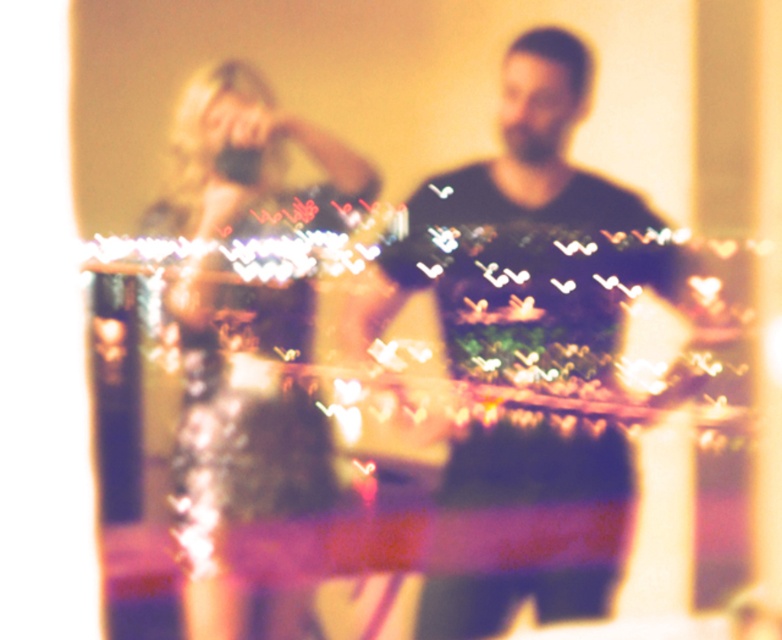
Between dark green sweater at center and shiny silver dress at center, which one has more height?

With more height is dark green sweater at center.

Is point (522, 492) closer to camera compared to point (357, 196)?

Yes, it is in front of point (357, 196).

The image size is (782, 640). I want to click on dark green sweater at center, so click(x=524, y=240).